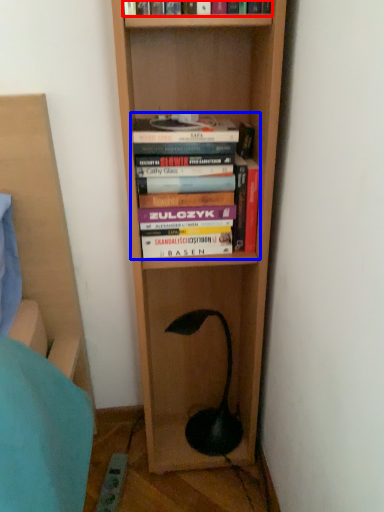
Question: Which object is closer to the camera taking this photo, book (highlighted by a red box) or book (highlighted by a blue box)?

Choices:
 (A) book
 (B) book

Answer: (A)